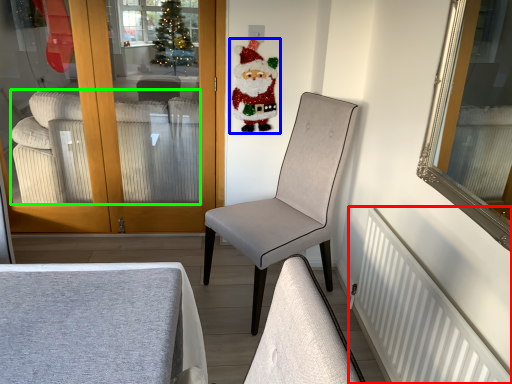
Question: Which object is positioned closest to radiator (highlighted by a red box)? Select from santa claus (highlighted by a blue box) and studio couch (highlighted by a green box).

Choices:
 (A) santa claus
 (B) studio couch

Answer: (A)